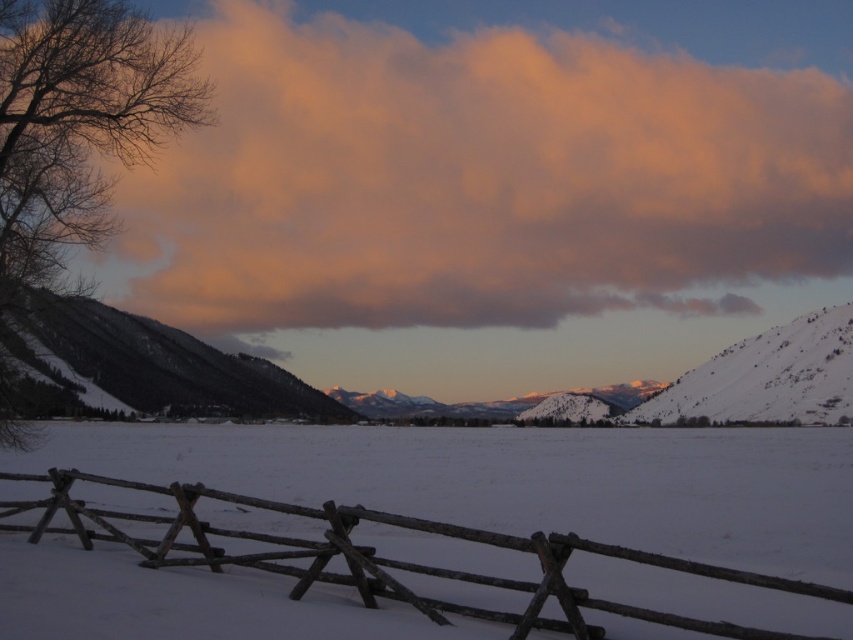
Between orange cotton cloud at upper center and snowy textured mountain at left, which one has less height?

snowy textured mountain at left is shorter.

Find the location of a particular element. This screenshot has width=853, height=640. orange cotton cloud at upper center is located at coordinates (480, 179).

I want to click on orange cotton cloud at upper center, so click(x=480, y=179).

Is orange cotton cloud at upper center to the left of brown wooden fence at lower center from the viewer's perspective?

No, orange cotton cloud at upper center is not to the left of brown wooden fence at lower center.

Locate an element on the screen. This screenshot has width=853, height=640. orange cotton cloud at upper center is located at coordinates (480, 179).

Who is positioned more to the right, brown wooden fence at lower center or snowy textured mountain at left?

Positioned to the right is brown wooden fence at lower center.

The image size is (853, 640). What do you see at coordinates (376, 556) in the screenshot? I see `brown wooden fence at lower center` at bounding box center [376, 556].

Does point (112, 515) come closer to viewer compared to point (228, 387)?

Yes, it is.

Find the location of a particular element. The width and height of the screenshot is (853, 640). brown wooden fence at lower center is located at coordinates point(376,556).